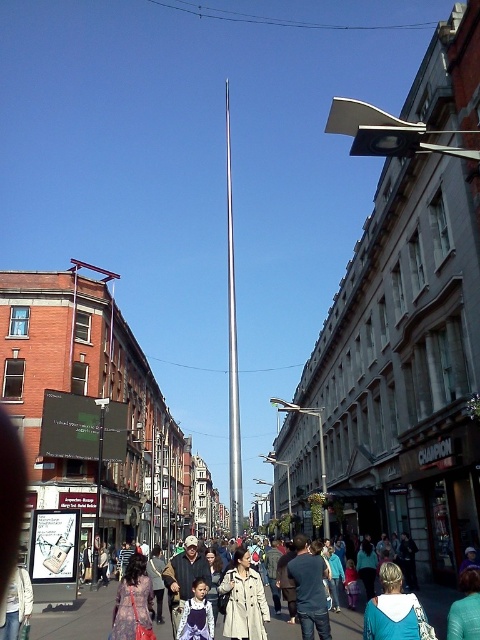
Between silver metallic flag pole at center and teal hoodie at lower right, which one appears on the left side from the viewer's perspective?

Positioned to the left is silver metallic flag pole at center.

Which is in front, point (228, 198) or point (409, 636)?

Point (409, 636)

Identify the location of silver metallic flag pole at center. Image resolution: width=480 pixels, height=640 pixels. (231, 353).